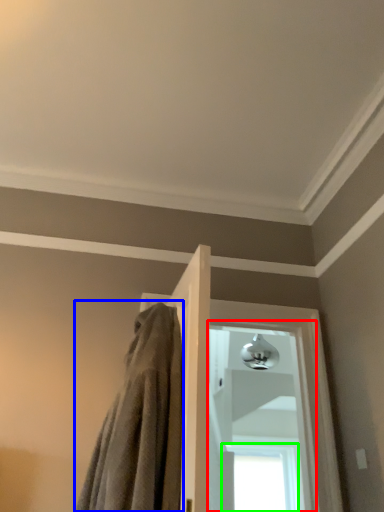
Question: Which is farther away from window (highlighted by a red box)? bath towel (highlighted by a blue box) or window (highlighted by a green box)?

Choices:
 (A) bath towel
 (B) window

Answer: (A)